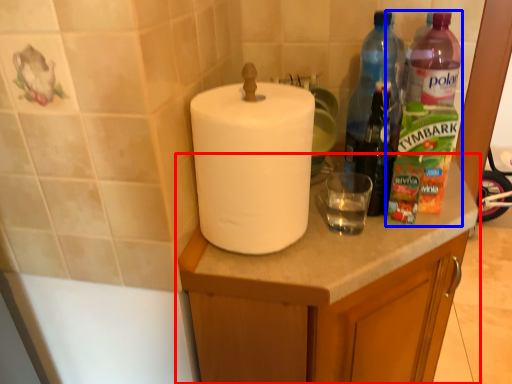
Question: Which object appears closest to the camera in this image, cabinetry (highlighted by a red box) or bottle (highlighted by a blue box)?

Choices:
 (A) cabinetry
 (B) bottle

Answer: (A)